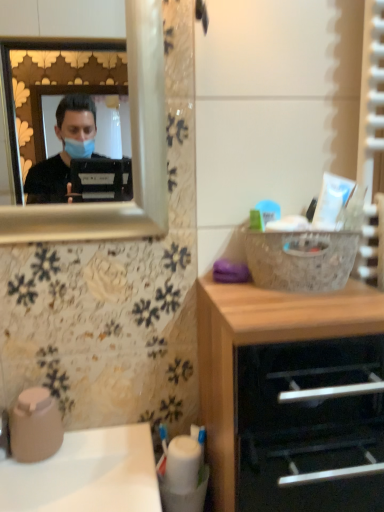
Question: Is wooden chest of drawers at lower right taller than white glossy sink at lower left?

Choices:
 (A) yes
 (B) no

Answer: (A)

Question: Is wooden chest of drawers at lower right further to the viewer compared to white glossy sink at lower left?

Choices:
 (A) no
 (B) yes

Answer: (A)

Question: From a real-world perspective, is wooden chest of drawers at lower right beneath white glossy sink at lower left?

Choices:
 (A) yes
 (B) no

Answer: (B)

Question: From the image's perspective, would you say wooden chest of drawers at lower right is positioned over white glossy sink at lower left?

Choices:
 (A) no
 (B) yes

Answer: (B)

Question: Is wooden chest of drawers at lower right aimed at white glossy sink at lower left?

Choices:
 (A) no
 (B) yes

Answer: (A)

Question: Can you confirm if wooden chest of drawers at lower right is bigger than white glossy sink at lower left?

Choices:
 (A) no
 (B) yes

Answer: (B)

Question: From a real-world perspective, is white glossy sink at lower left beneath wooden chest of drawers at lower right?

Choices:
 (A) no
 (B) yes

Answer: (B)

Question: Could you tell me if white glossy sink at lower left is facing wooden chest of drawers at lower right?

Choices:
 (A) yes
 (B) no

Answer: (B)

Question: Is the surface of white glossy sink at lower left in direct contact with wooden chest of drawers at lower right?

Choices:
 (A) yes
 (B) no

Answer: (B)

Question: Can you confirm if white glossy sink at lower left is thinner than wooden chest of drawers at lower right?

Choices:
 (A) no
 (B) yes

Answer: (B)

Question: Does white glossy sink at lower left have a lesser height compared to wooden chest of drawers at lower right?

Choices:
 (A) no
 (B) yes

Answer: (B)

Question: Is white glossy sink at lower left not near wooden chest of drawers at lower right?

Choices:
 (A) no
 (B) yes

Answer: (A)

Question: Based on their sizes in the image, would you say wooden chest of drawers at lower right is bigger or smaller than white glossy sink at lower left?

Choices:
 (A) big
 (B) small

Answer: (A)